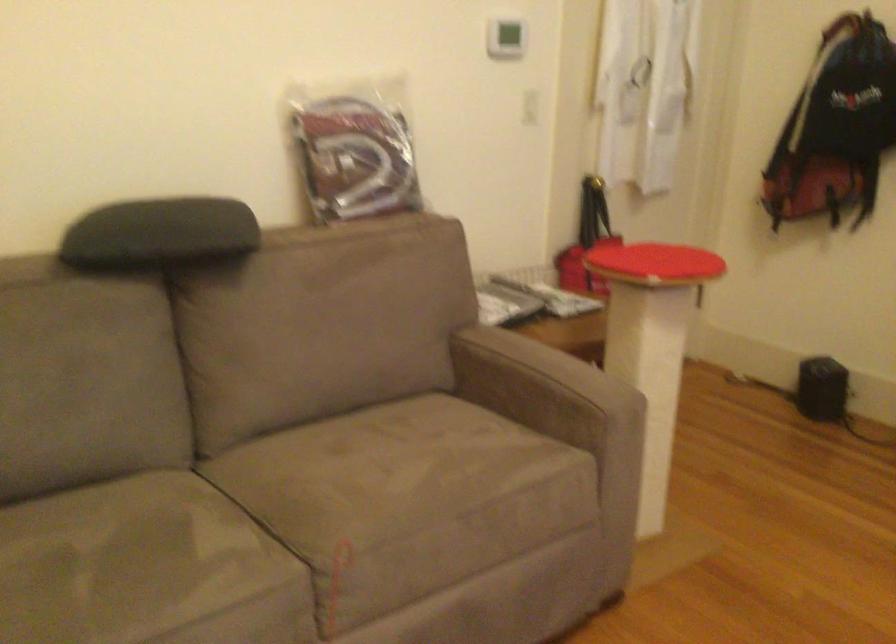
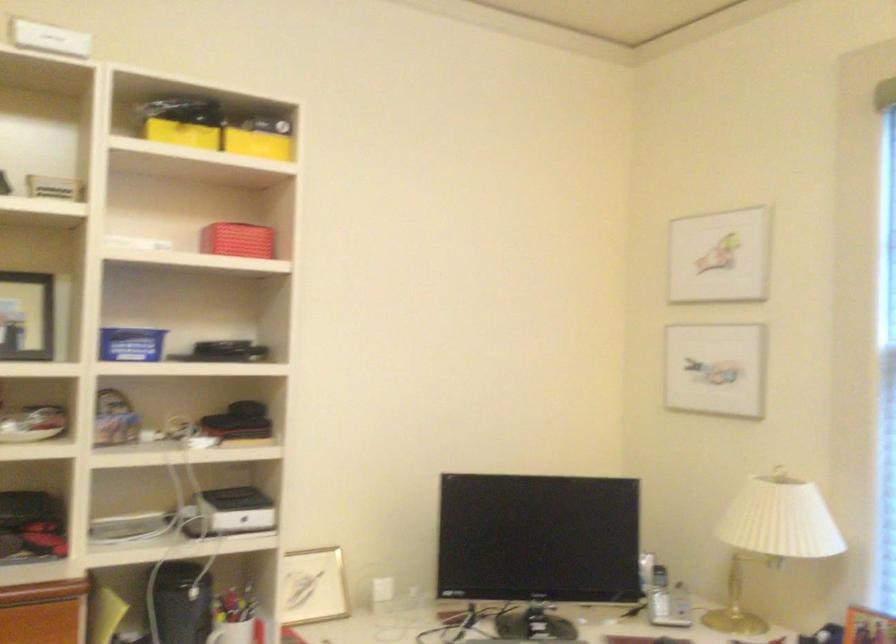
Question: The camera is either moving clockwise (left) or counter-clockwise (right) around the object. The first image is from the beginning of the video and the second image is from the end. Is the camera moving left or right when shooting the video?

Choices:
 (A) Left
 (B) Right

Answer: (A)